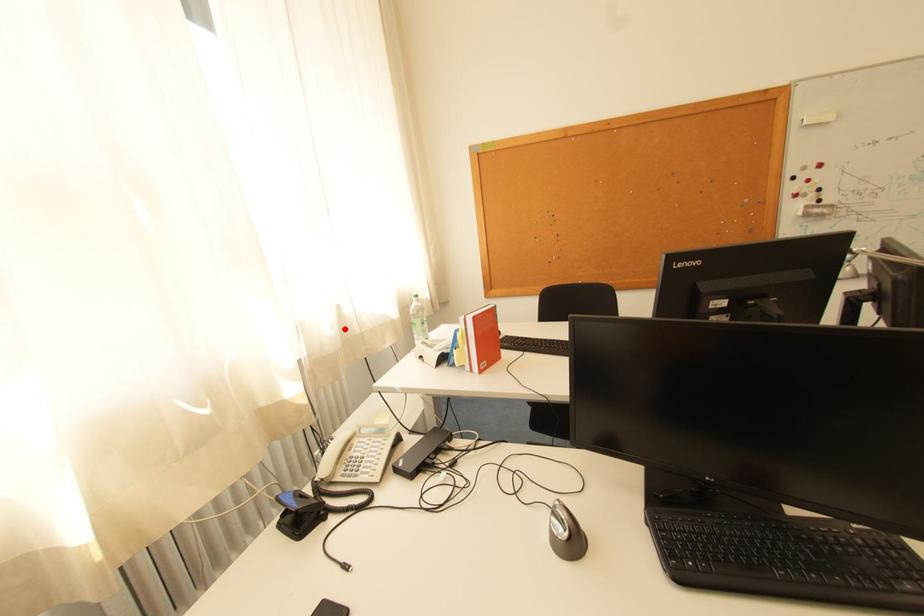
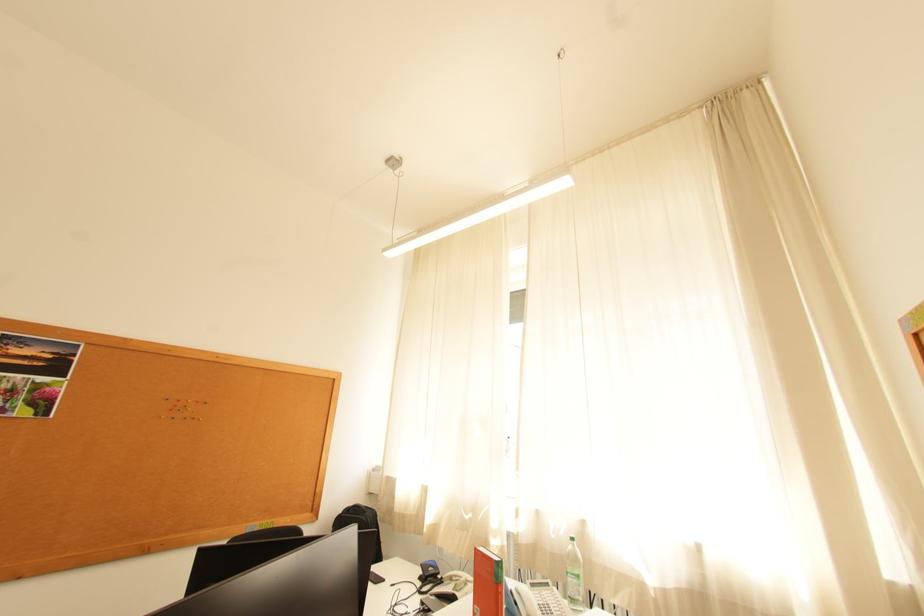
Where in the second image is the point corresponding to the highlighted location from the first image?

(569, 536)